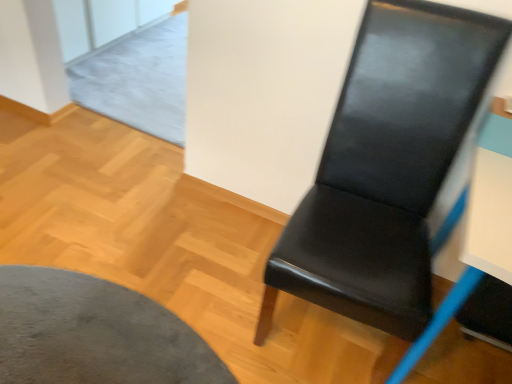
Where is `blank area beneath black leather chair at right (from a real-world perspective)`? Image resolution: width=512 pixels, height=384 pixels. blank area beneath black leather chair at right (from a real-world perspective) is located at coordinates (325, 335).